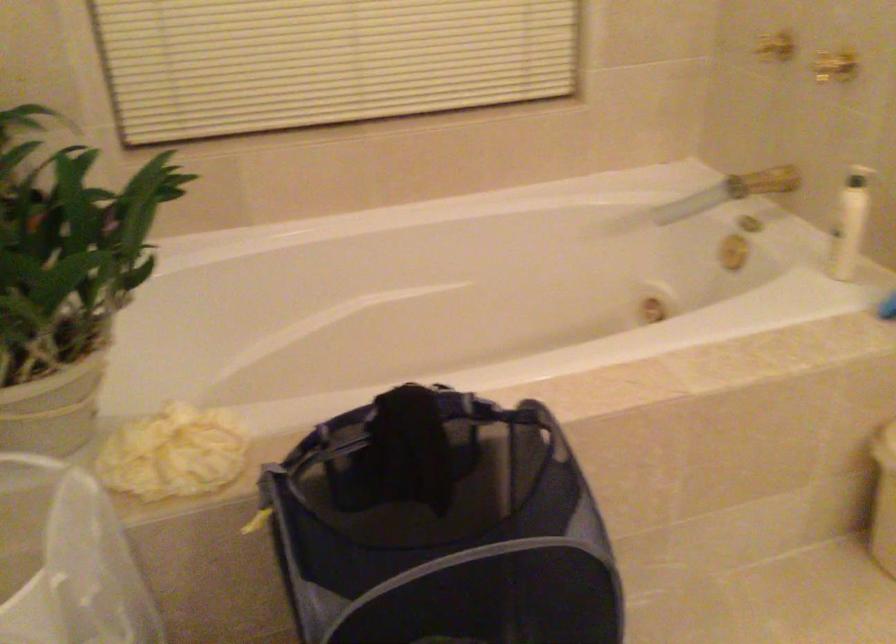
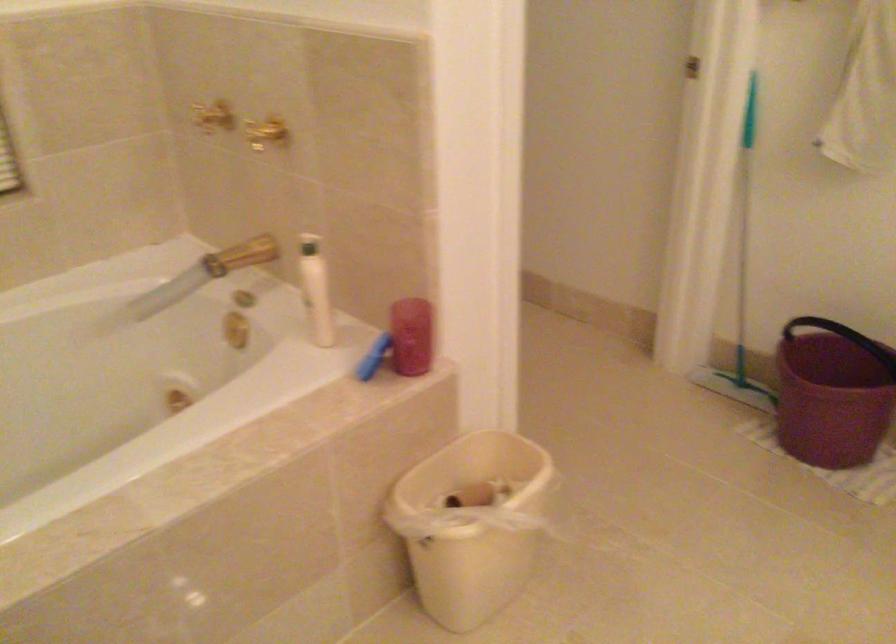
Find the pixel in the second image that matches (755,176) in the first image.

(240, 254)